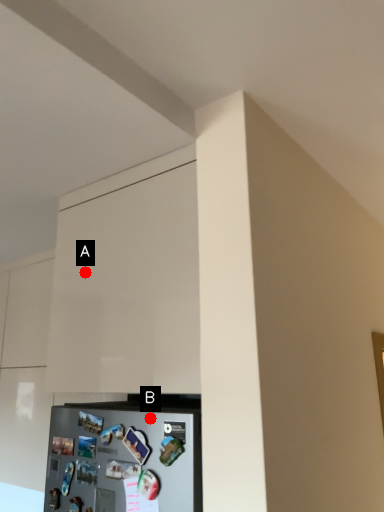
Question: Two points are circled on the image, labeled by A and B beside each circle. Which point is closer to the camera taking this photo?

Choices:
 (A) A is closer
 (B) B is closer

Answer: (B)